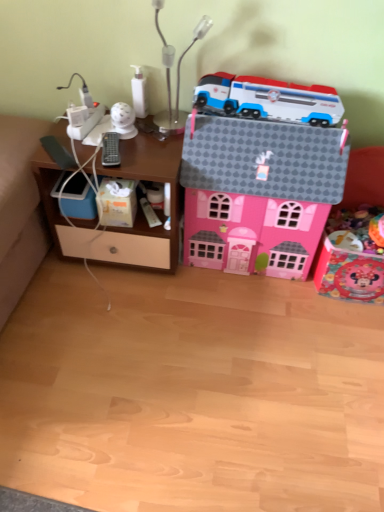
The height and width of the screenshot is (512, 384). Find the location of `free space in front of white glossy security camera at upper center, the sixth toy positioned from the right`. free space in front of white glossy security camera at upper center, the sixth toy positioned from the right is located at coordinates (132, 156).